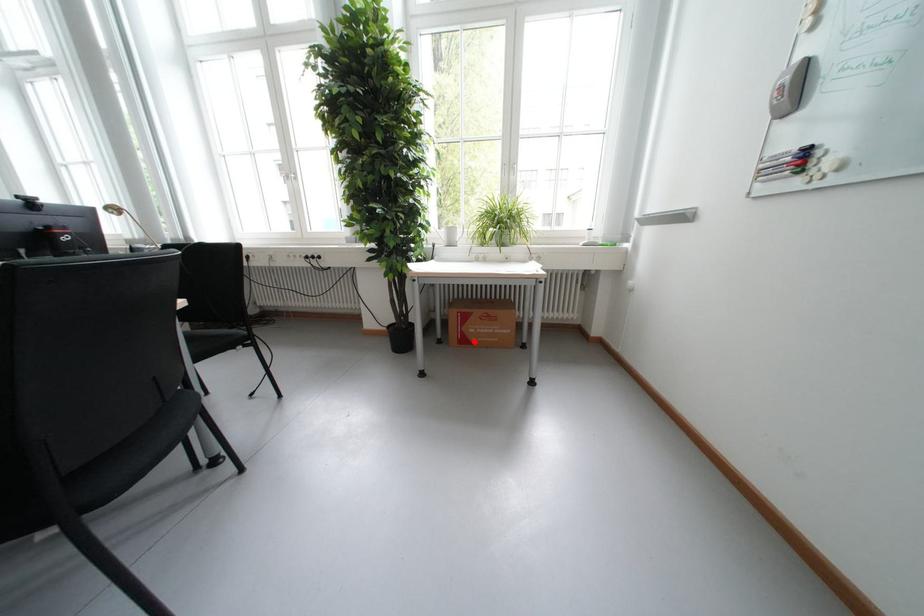
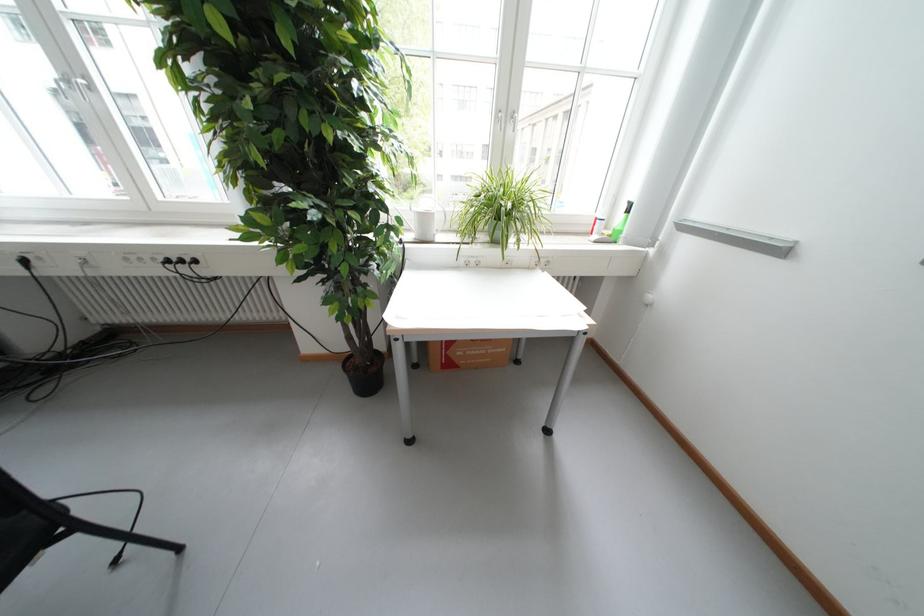
Question: I am providing you with two images of the same scene from different viewpoints. A red point is marked on the first image. Is the red point's position out of view in image 2?

Choices:
 (A) Yes
 (B) No

Answer: (B)